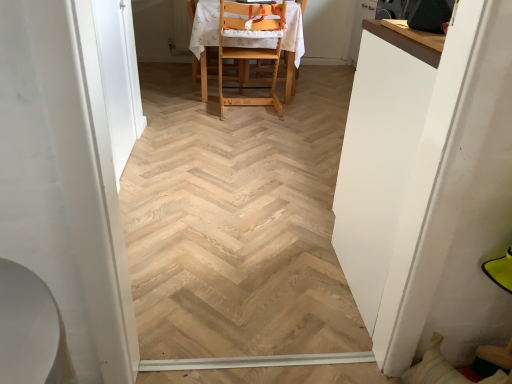
Image resolution: width=512 pixels, height=384 pixels. Identify the location of vacant space in front of white glossy door at left, acting as the second screen door starting from the front. (153, 196).